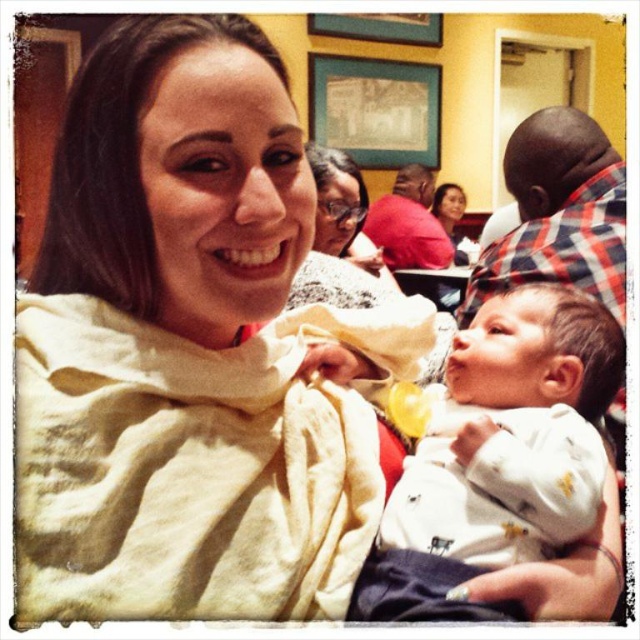
Between white soft scarf at center and white matte arm at center, which one appears on the right side from the viewer's perspective?

white matte arm at center

Who is shorter, white soft scarf at center or white matte arm at center?

white matte arm at center is shorter.

Describe the element at coordinates (180, 352) in the screenshot. The image size is (640, 640). I see `white soft scarf at center` at that location.

Locate an element on the screen. white soft scarf at center is located at coordinates (180, 352).

Between white soft scarf at center and white soft fabric baby at center, which one has more height?

white soft scarf at center is taller.

Who is lower down, white soft scarf at center or white soft fabric baby at center?

white soft fabric baby at center

Is point (208, 193) farther from viewer compared to point (598, 477)?

No, (208, 193) is closer to viewer.

At what (x,y) coordinates should I click in order to perform the action: click on white soft scarf at center. Please return your answer as a coordinate pair (x, y). The height and width of the screenshot is (640, 640). Looking at the image, I should click on (180, 352).

Which is more to the right, white soft fabric baby at center or white matte arm at center?

From the viewer's perspective, white matte arm at center appears more on the right side.

Who is more forward, (472,451) or (582,609)?

Point (582,609)

Which is behind, point (394, 496) or point (564, 563)?

Positioned behind is point (394, 496).

The image size is (640, 640). Identify the location of white soft fabric baby at center. (x=513, y=433).